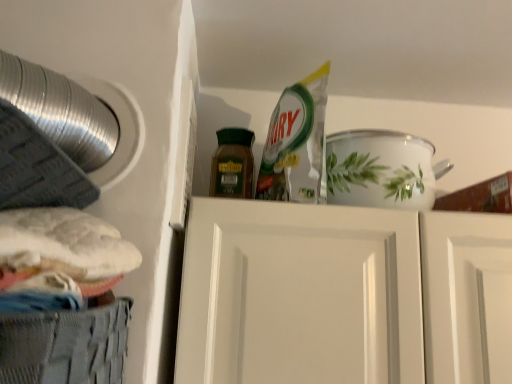
Question: Is point (38, 342) positioned closer to the camera than point (490, 296)?

Choices:
 (A) farther
 (B) closer

Answer: (B)

Question: Considering the positions of gray mesh basket at lower left and white glossy door at center in the image, is gray mesh basket at lower left taller or shorter than white glossy door at center?

Choices:
 (A) tall
 (B) short

Answer: (B)

Question: Considering the real-world distances, which object is closest to the brown matte jar at center?

Choices:
 (A) gray mesh basket at lower left
 (B) white glossy door at center

Answer: (B)

Question: Estimate the real-world distances between objects in this image. Which object is farther from the gray mesh basket at lower left?

Choices:
 (A) white glossy door at center
 (B) brown matte jar at center

Answer: (B)